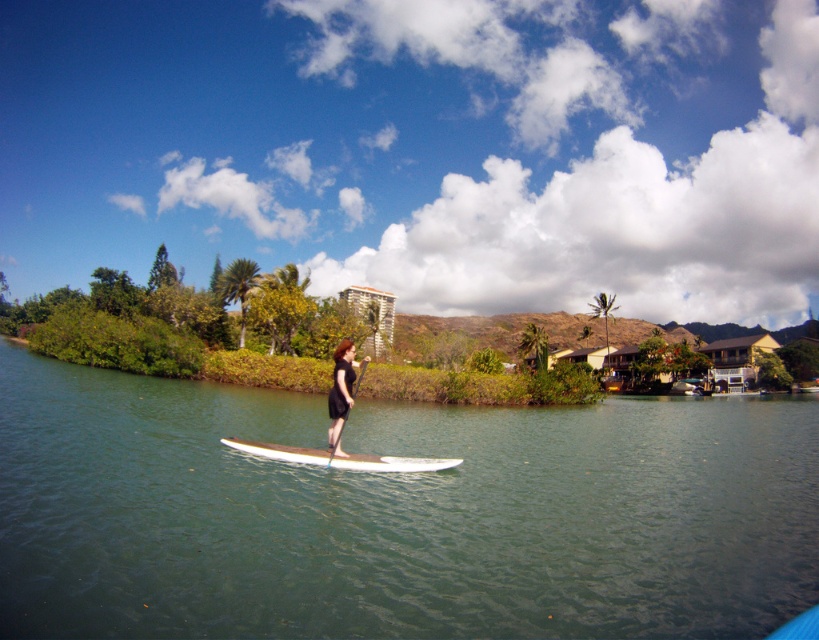
This screenshot has width=819, height=640. Describe the element at coordinates (396, 515) in the screenshot. I see `green smooth water at center` at that location.

Which is in front, point (43, 579) or point (328, 458)?

Point (43, 579)

At what (x,y) coordinates should I click in order to perform the action: click on green smooth water at center. Please return your answer as a coordinate pair (x, y). Looking at the image, I should click on (396, 515).

Is point (320, 538) more distant than point (388, 461)?

That is False.

Does green smooth water at center have a lesser height compared to white smooth surfboard at center?

In fact, green smooth water at center may be taller than white smooth surfboard at center.

Where is `green smooth water at center`? The image size is (819, 640). green smooth water at center is located at coordinates (396, 515).

Is white smooth surfboard at center to the right of white glossy paddleboard at center from the viewer's perspective?

Correct, you'll find white smooth surfboard at center to the right of white glossy paddleboard at center.

Does white smooth surfboard at center have a larger size compared to white glossy paddleboard at center?

No, white smooth surfboard at center is not bigger than white glossy paddleboard at center.

I want to click on white smooth surfboard at center, so click(x=340, y=458).

The width and height of the screenshot is (819, 640). I want to click on white smooth surfboard at center, so click(x=340, y=458).